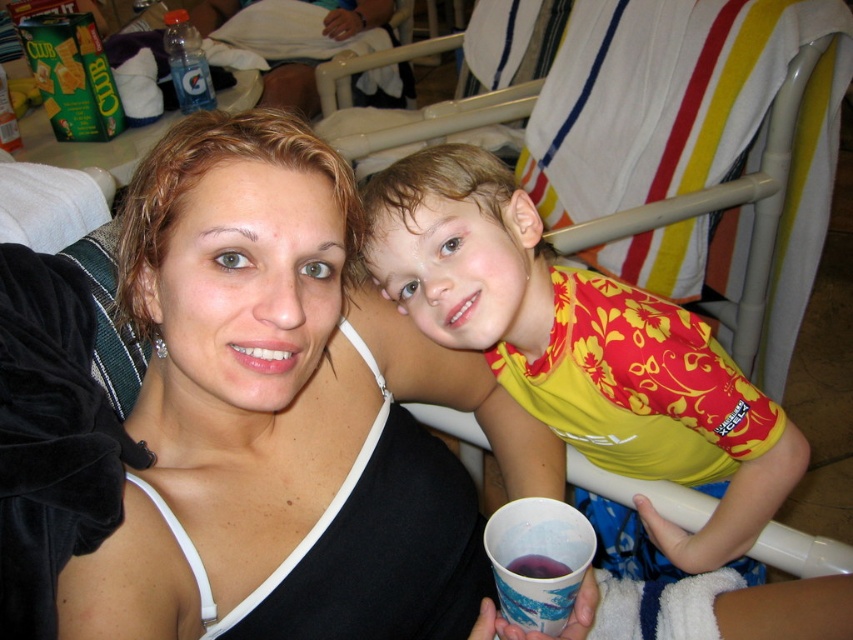
Does point (560, 557) come farther from viewer compared to point (521, 563)?

No, (560, 557) is closer to viewer.

Measure the distance between point (532, 600) and camera.

Point (532, 600) and camera are 23.51 inches apart from each other.

I want to click on purple paper cup at lower center, so click(537, 588).

Is point (682, 397) positioned before point (556, 557)?

That is False.

At what (x,y) coordinates should I click in order to perform the action: click on yellow floral shirt at upper right. Please return your answer as a coordinate pair (x, y). This screenshot has width=853, height=640. Looking at the image, I should click on (584, 358).

Which is below, yellow floral shirt at upper right or purple matte liquid at cup right?

Positioned lower is purple matte liquid at cup right.

Where is `yellow floral shirt at upper right`? yellow floral shirt at upper right is located at coordinates (584, 358).